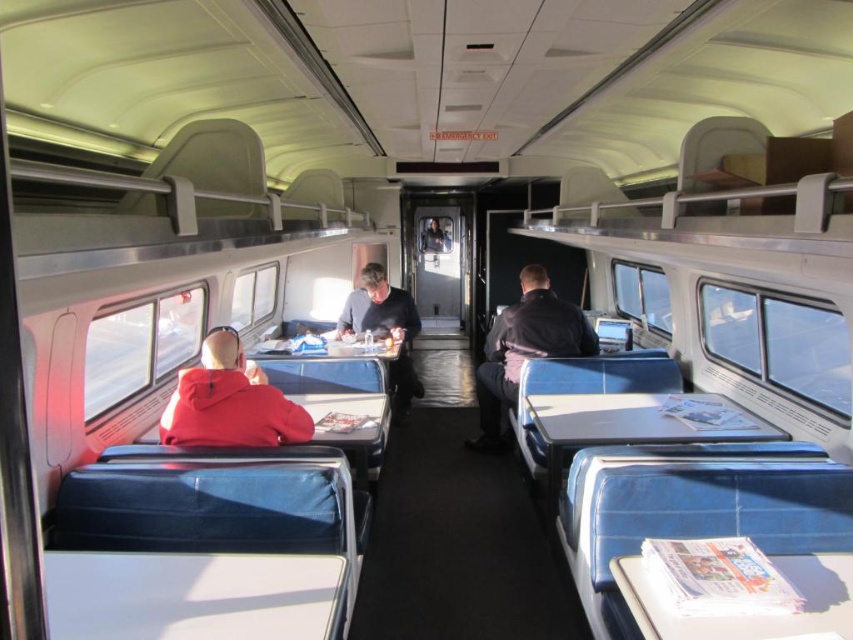
Does dark blue leather jacket at center have a smaller size compared to dark gray jacket at center?

No, dark blue leather jacket at center is not smaller than dark gray jacket at center.

Which of these two, dark blue leather jacket at center or dark gray jacket at center, stands taller?

dark blue leather jacket at center is taller.

Who is more distant from viewer, (486, 348) or (358, 304)?

Point (358, 304)

This screenshot has width=853, height=640. I want to click on dark blue leather jacket at center, so click(524, 349).

The image size is (853, 640). What do you see at coordinates (229, 401) in the screenshot?
I see `red fleece jacket at left` at bounding box center [229, 401].

Is red fleece jacket at left wider than dark gray jacket at center?

In fact, red fleece jacket at left might be narrower than dark gray jacket at center.

In order to click on red fleece jacket at left in this screenshot , I will do `click(229, 401)`.

Find the location of a particular element. red fleece jacket at left is located at coordinates (229, 401).

Between red fleece jacket at left and dark blue leather jacket at center, which one appears on the right side from the viewer's perspective?

Positioned to the right is dark blue leather jacket at center.

Is red fleece jacket at left to the left of dark blue leather jacket at center from the viewer's perspective?

Correct, you'll find red fleece jacket at left to the left of dark blue leather jacket at center.

Who is more forward, (224, 340) or (486, 436)?

Point (224, 340)

Find the location of a particular element. The height and width of the screenshot is (640, 853). red fleece jacket at left is located at coordinates (229, 401).